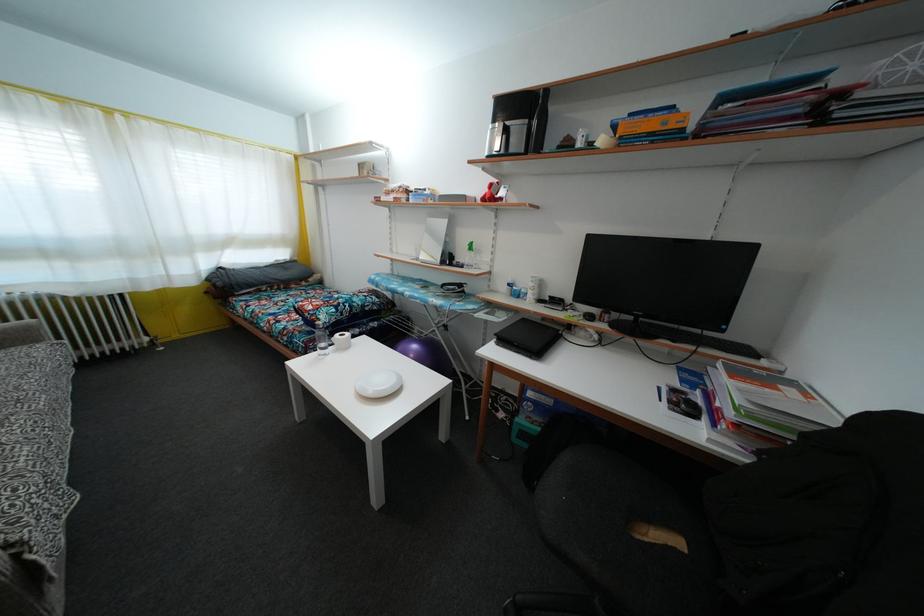
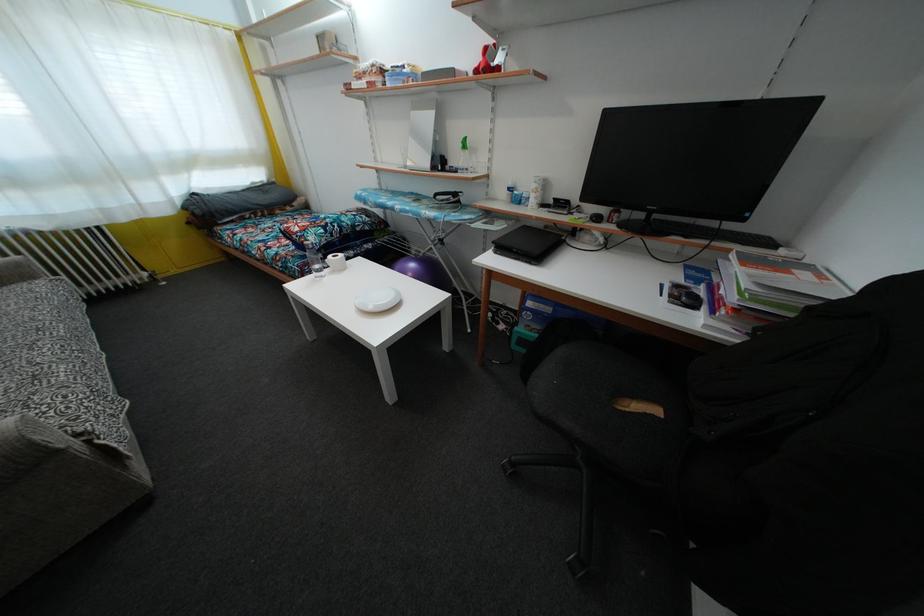
Where in the second image is the point corresponding to the point at 419,353 from the first image?

(416, 272)